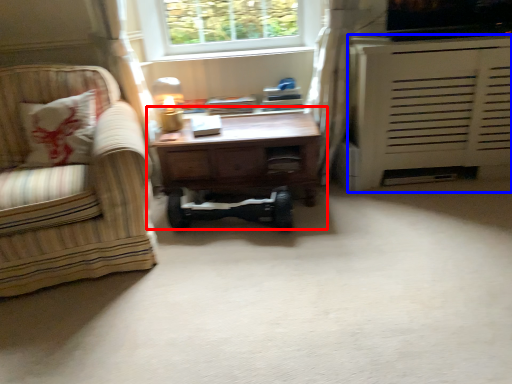
Question: Which object is closer to the camera taking this photo, table (highlighted by a red box) or cabinetry (highlighted by a blue box)?

Choices:
 (A) table
 (B) cabinetry

Answer: (B)